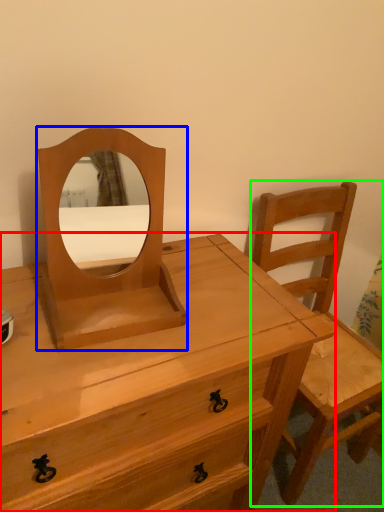
Question: Based on their relative distances, which object is nearer to chest of drawers (highlighted by a red box)? Choose from mirror (highlighted by a blue box) and chair (highlighted by a green box).

Choices:
 (A) mirror
 (B) chair

Answer: (A)